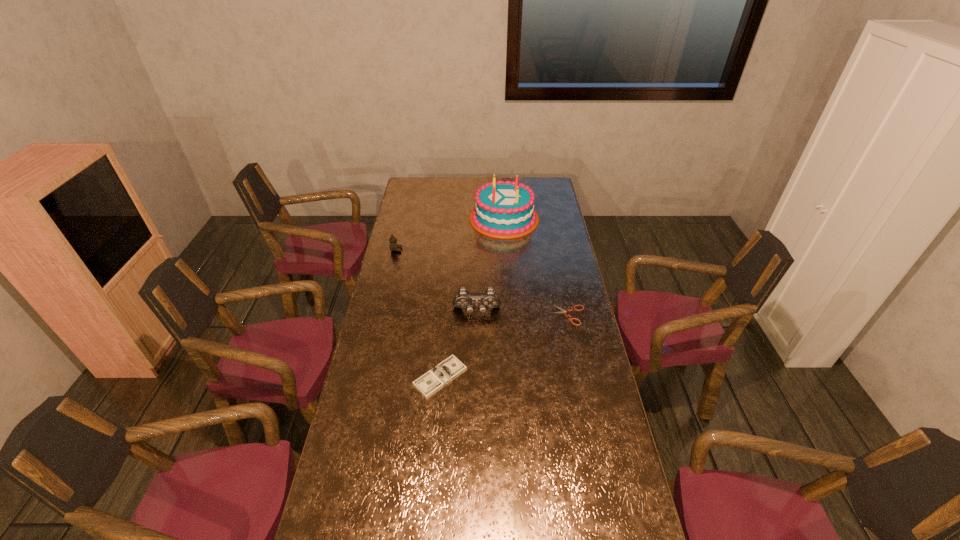
Where is `birthday cake`? The image size is (960, 540). birthday cake is located at coordinates (504, 209).

Where is `the farthest object`? the farthest object is located at coordinates (504, 209).

Identify the location of control. The width and height of the screenshot is (960, 540). (463, 299).

Where is `teddy bear`? The image size is (960, 540). teddy bear is located at coordinates (393, 246).

Identify the location of the fourth nearest object. (393, 246).

You are a GUI agent. You are given a task and a screenshot of the screen. Output one action in this format:
    pyautogui.click(x=<x>, y=<y>)
    Task: Click on the nearest object
    
    Given the screenshot: What is the action you would take?
    pyautogui.click(x=429, y=383)

Find the location of a particular element. This screenshot has height=540, width=960. dollar is located at coordinates (429, 383).

Where is `the shortest object`? This screenshot has width=960, height=540. the shortest object is located at coordinates (562, 310).

At what (x,y) coordinates should I click in order to perform the action: click on vacant area located on the front of the tallest object. Please return your answer as a coordinate pair (x, y). This screenshot has width=960, height=540. Looking at the image, I should click on (507, 254).

The width and height of the screenshot is (960, 540). Find the location of `free space located 0.290m on the surface of the second tallest object with buttons`. free space located 0.290m on the surface of the second tallest object with buttons is located at coordinates (476, 382).